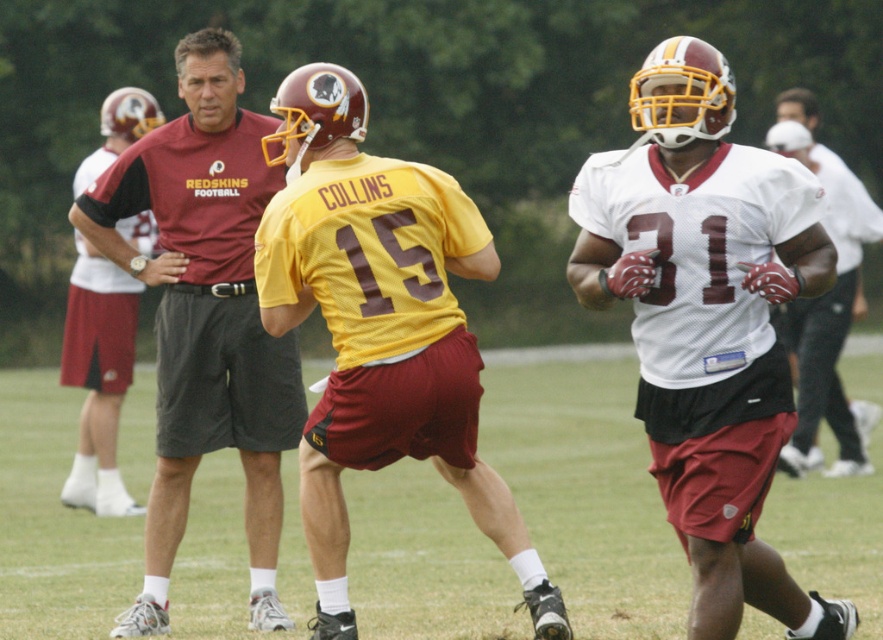
Measure the distance from white mesh jersey at center to maroon fabric shirt at center.

white mesh jersey at center and maroon fabric shirt at center are 7.65 meters apart from each other.

Is point (680, 412) positioned after point (110, 305)?

No, it is in front of (110, 305).

Find the location of `white mesh jersey at center`. white mesh jersey at center is located at coordinates pyautogui.click(x=708, y=323).

Is yellow jersey at center above maroon fabric shirt at center?

Yes.

Between yellow jersey at center and maroon fabric shirt at center, which one is positioned lower?

Positioned lower is maroon fabric shirt at center.

The height and width of the screenshot is (640, 883). In order to click on yellow jersey at center in this screenshot , I will do `click(380, 330)`.

Identify the location of yellow jersey at center. (380, 330).

Does green grass at center appear over yellow jersey at center?

Actually, green grass at center is below yellow jersey at center.

Which is behind, point (663, 609) or point (500, 488)?

Point (663, 609)

Find the location of a particular element. This screenshot has width=883, height=640. green grass at center is located at coordinates (587, 490).

Where is `green grass at center`? This screenshot has width=883, height=640. green grass at center is located at coordinates (587, 490).